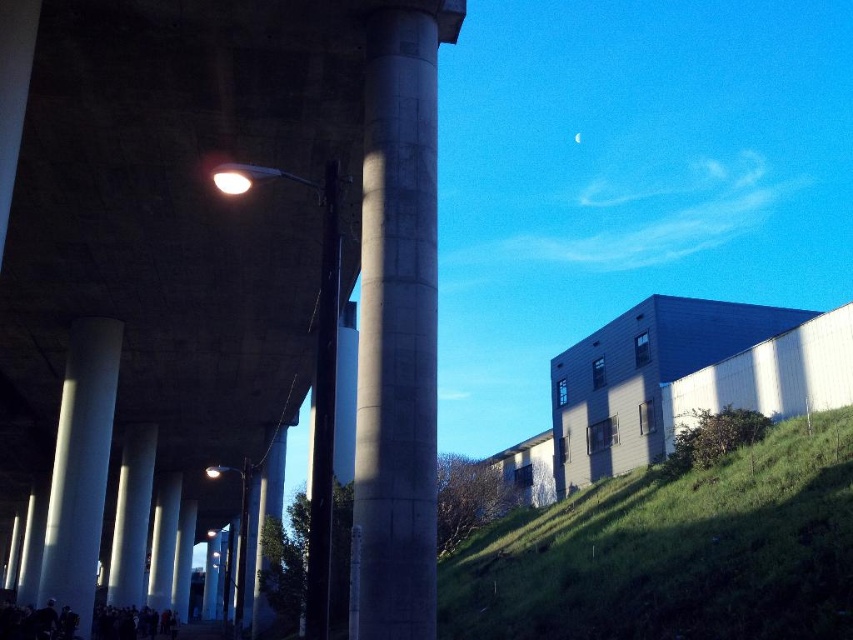
Question: Among these points, which one is nearest to the camera?

Choices:
 (A) (114, 388)
 (B) (326, 243)
 (C) (158, 497)
 (D) (787, 481)

Answer: (B)

Question: Is concrete at center positioned behind black glossy pole at center?

Choices:
 (A) yes
 (B) no

Answer: (A)

Question: Where is green grassy hillside at lower right located in relation to concrete at center in the image?

Choices:
 (A) left
 (B) right

Answer: (B)

Question: Is white concrete pillar at lower left below smooth concrete pillar at center?

Choices:
 (A) yes
 (B) no

Answer: (B)

Question: Estimate the real-world distances between objects in this image. Which object is farther from the white concrete pillar at lower left?

Choices:
 (A) black glossy pole at center
 (B) concrete pillar at center
 (C) concrete at left
 (D) green grassy hillside at lower right

Answer: (D)

Question: Which object appears closest to the camera in this image?

Choices:
 (A) black glossy pole at center
 (B) green grassy hillside at lower right
 (C) smooth concrete pillar at center

Answer: (A)